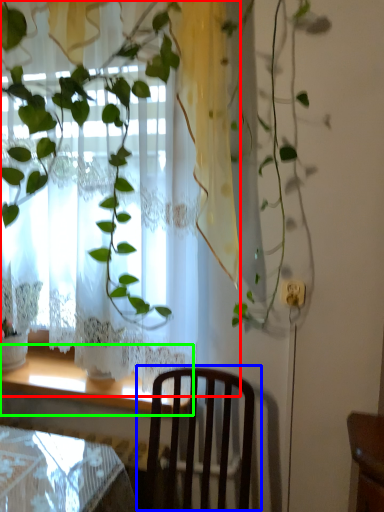
Question: Considering the real-world distances, which object is farthest from curtain (highlighted by a red box)? chair (highlighted by a blue box) or window sill (highlighted by a green box)?

Choices:
 (A) chair
 (B) window sill

Answer: (B)